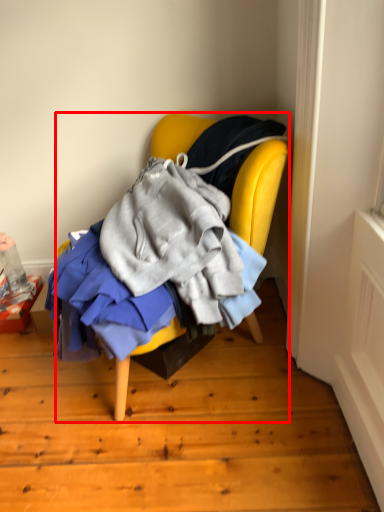
Question: From the image, what is the correct spatial relationship of chair (annotated by the red box) in relation to box?

Choices:
 (A) right
 (B) left

Answer: (A)